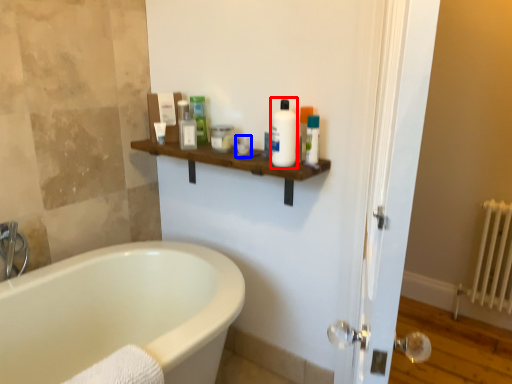
Question: Among these objects, which one is farthest to the camera, cleaning product (highlighted by a red box) or toiletry (highlighted by a blue box)?

Choices:
 (A) cleaning product
 (B) toiletry

Answer: (B)